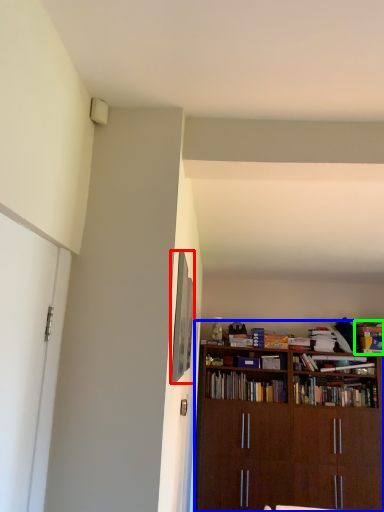
Question: Which object is the farthest from picture frame (highlighted by a red box)? Choose among these: bookcase (highlighted by a blue box) or book (highlighted by a green box).

Choices:
 (A) bookcase
 (B) book

Answer: (B)